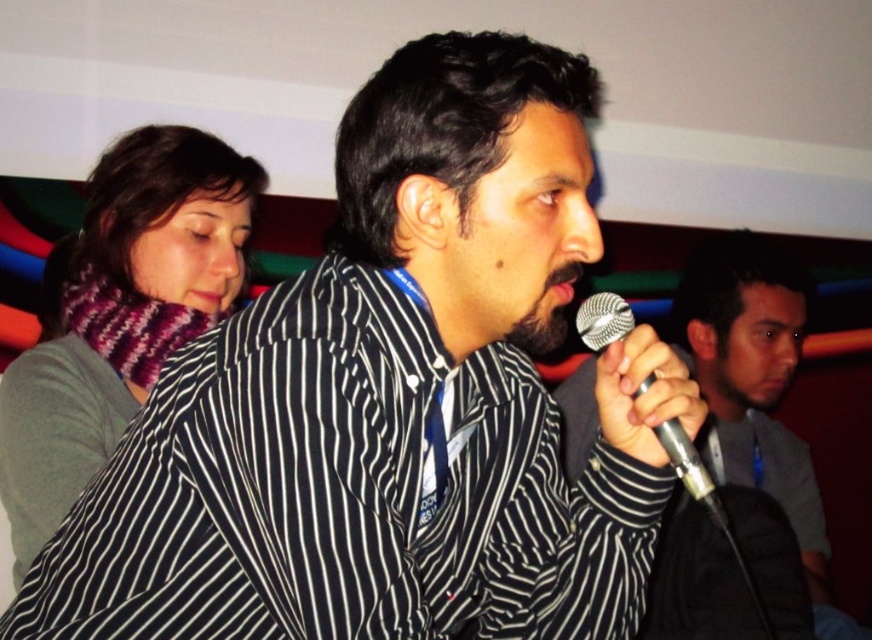
Is black matte microphone at center behind silver metallic microphone at center?

Yes.

Who is lower down, black matte microphone at center or silver metallic microphone at center?

black matte microphone at center is lower down.

The width and height of the screenshot is (872, 640). Describe the element at coordinates (755, 385) in the screenshot. I see `black matte microphone at center` at that location.

Where is `black matte microphone at center`? The width and height of the screenshot is (872, 640). black matte microphone at center is located at coordinates (755, 385).

Is knitted wool scarf at upper left to the right of black matte microphone at center from the viewer's perspective?

No, knitted wool scarf at upper left is not to the right of black matte microphone at center.

Does knitted wool scarf at upper left have a smaller size compared to black matte microphone at center?

Correct, knitted wool scarf at upper left occupies less space than black matte microphone at center.

You are a GUI agent. You are given a task and a screenshot of the screen. Output one action in this format:
    pyautogui.click(x=<x>, y=<y>)
    Task: Click on the knitted wool scarf at upper left
    
    Given the screenshot: What is the action you would take?
    pyautogui.click(x=119, y=314)

At what (x,y) coordinates should I click in order to perform the action: click on knitted wool scarf at upper left. Please return your answer as a coordinate pair (x, y). This screenshot has height=640, width=872. Looking at the image, I should click on (119, 314).

Who is taller, knitted wool scarf at upper left or silver metallic microphone at center?

knitted wool scarf at upper left

Does point (101, 336) lie in front of point (617, 317)?

No, it is behind (617, 317).

Which is in front, point (194, 208) or point (693, 490)?

Point (693, 490) is in front.

The image size is (872, 640). What are the coordinates of `knitted wool scarf at upper left` in the screenshot? It's located at pyautogui.click(x=119, y=314).